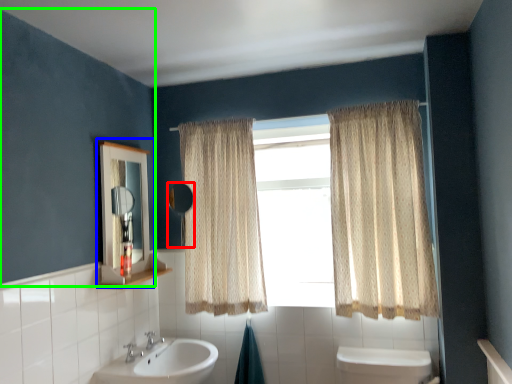
Question: Based on their relative distances, which object is farther from mirror (highlighted by a red box)? Choose from medicine cabinet (highlighted by a blue box) and backdrop (highlighted by a green box).

Choices:
 (A) medicine cabinet
 (B) backdrop

Answer: (B)